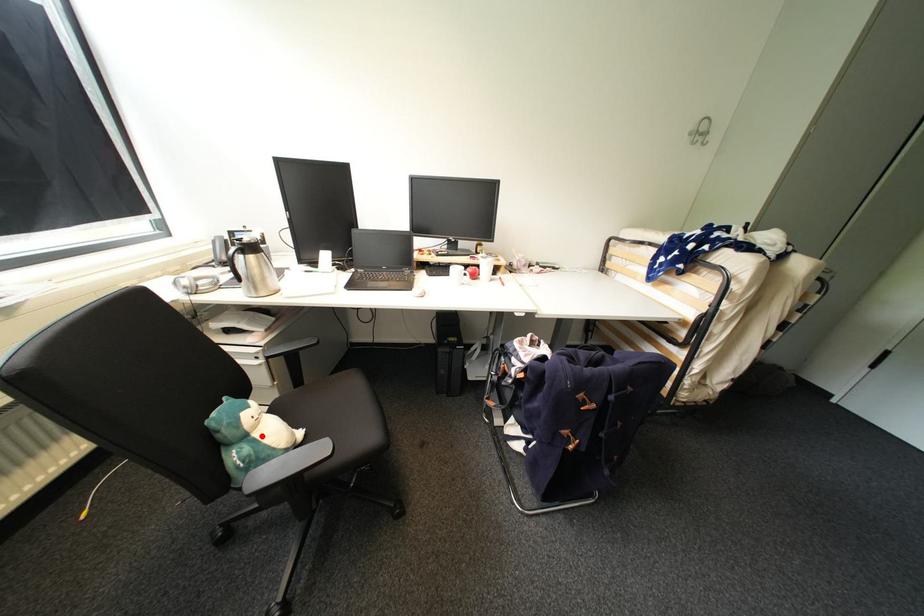
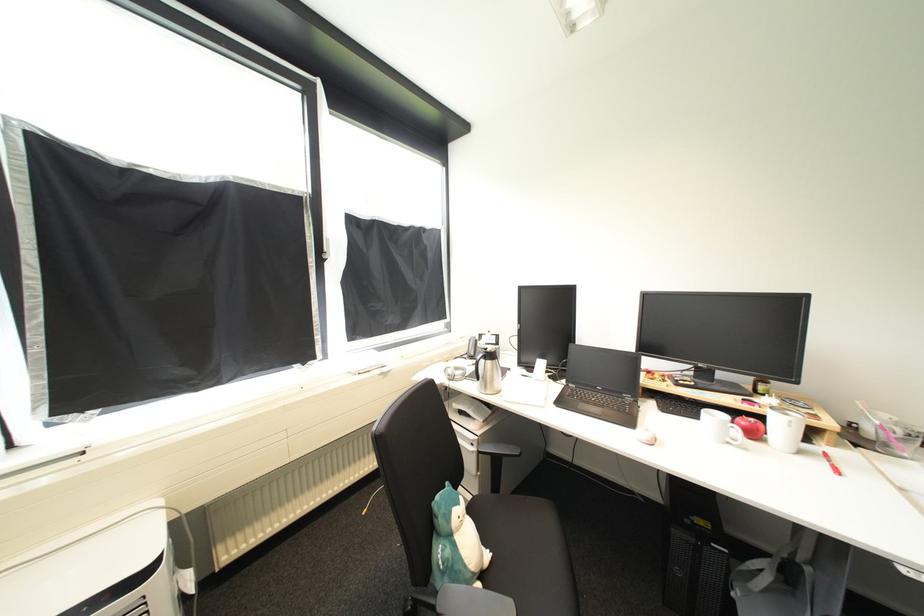
Question: I am providing you with two images of the same scene from different viewpoints. A red point is marked on the first image. Can you still see the location of the red point in image 2?

Choices:
 (A) Yes
 (B) No

Answer: (A)